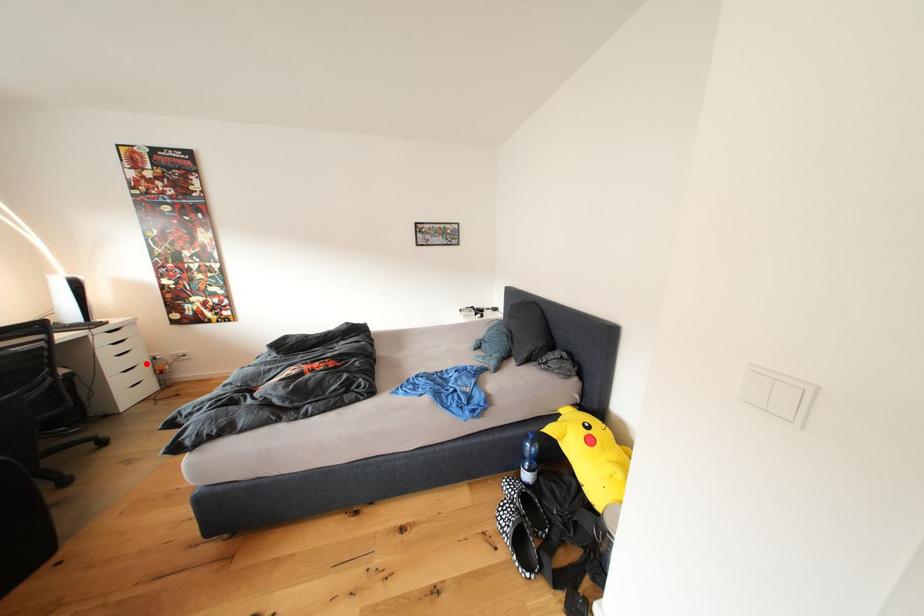
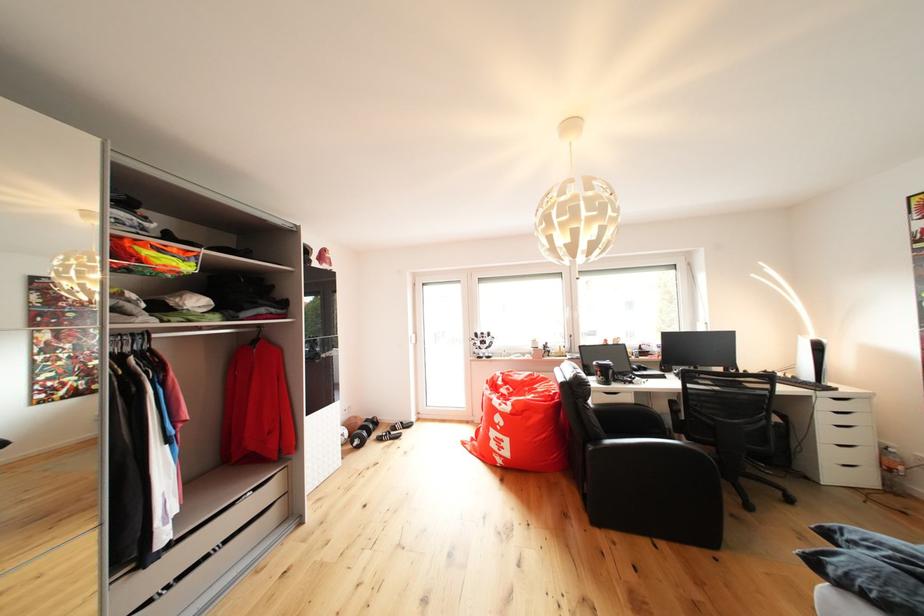
Where in the second image is the point corresponding to the highlighted location from the first image?

(869, 444)